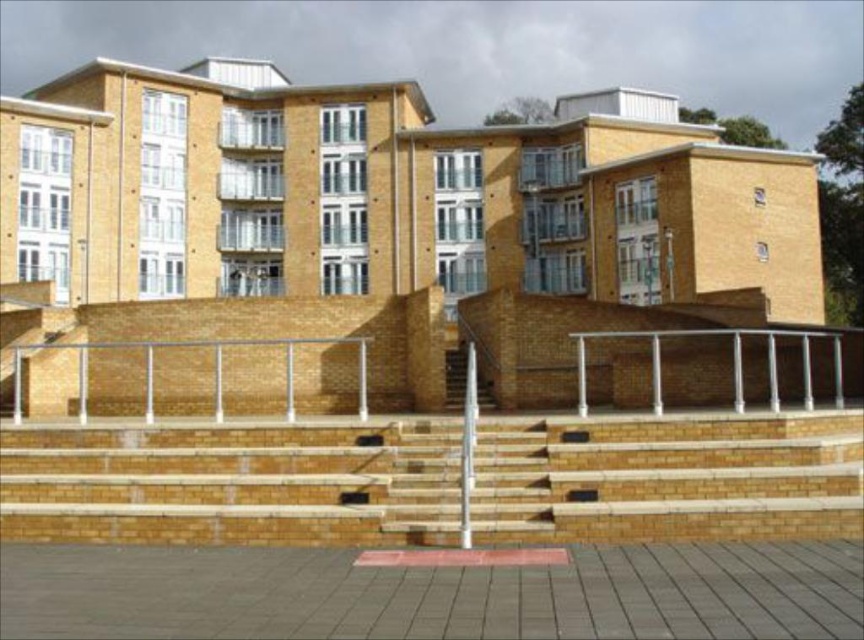
Question: Which point is closer to the camera?

Choices:
 (A) silver metallic rail at center
 (B) smooth concrete stairs at center

Answer: (A)

Question: Which object appears farthest from the camera in this image?

Choices:
 (A) smooth concrete stairs at center
 (B) silver metallic rail at center

Answer: (A)

Question: Which point appears farthest from the camera in this image?

Choices:
 (A) (808, 385)
 (B) (454, 394)

Answer: (B)

Question: Observing the image, what is the correct spatial positioning of silver metallic rail at center in reference to smooth concrete stairs at center?

Choices:
 (A) above
 (B) below

Answer: (A)

Question: Is silver metallic rail at center smaller than smooth concrete stairs at center?

Choices:
 (A) yes
 (B) no

Answer: (B)

Question: Does silver metallic rail at center have a larger size compared to smooth concrete stairs at center?

Choices:
 (A) yes
 (B) no

Answer: (A)